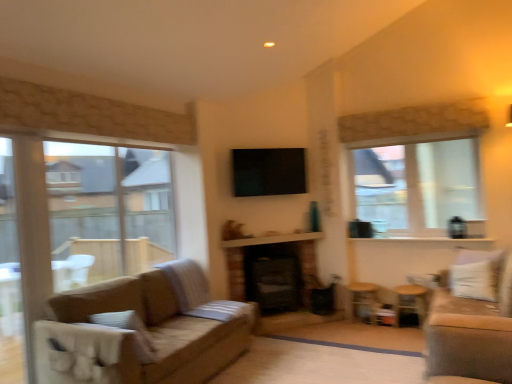
Question: Considering the relative sizes of white textured balcony at center and wooden side table at lower right, the 2th side table viewed from the left, in the image provided, is white textured balcony at center bigger than wooden side table at lower right, the 2th side table viewed from the left,?

Choices:
 (A) no
 (B) yes

Answer: (A)

Question: Is white textured balcony at center smaller than wooden side table at lower right, the 2th side table viewed from the left?

Choices:
 (A) yes
 (B) no

Answer: (A)

Question: Is white textured balcony at center with wooden side table at lower right, which appears as the first side table when viewed from the right?

Choices:
 (A) yes
 (B) no

Answer: (B)

Question: Considering the relative positions of white textured balcony at center and wooden side table at lower right, which appears as the first side table when viewed from the right, in the image provided, is white textured balcony at center to the left of wooden side table at lower right, which appears as the first side table when viewed from the right, from the viewer's perspective?

Choices:
 (A) no
 (B) yes

Answer: (B)

Question: Is the depth of white textured balcony at center greater than that of wooden side table at lower right, the 2th side table viewed from the left?

Choices:
 (A) no
 (B) yes

Answer: (B)

Question: Is white textured balcony at center taller than wooden side table at lower right, which appears as the first side table when viewed from the right?

Choices:
 (A) yes
 (B) no

Answer: (B)

Question: Considering the relative sizes of wooden side table at lower right, which is the second side table in right-to-left order, and black brick fireplace at center in the image provided, is wooden side table at lower right, which is the second side table in right-to-left order, thinner than black brick fireplace at center?

Choices:
 (A) yes
 (B) no

Answer: (A)

Question: Is black brick fireplace at center located within wooden side table at lower right, the 1th side table from the left?

Choices:
 (A) yes
 (B) no

Answer: (B)

Question: Considering the relative positions of wooden side table at lower right, which is the second side table in right-to-left order, and black brick fireplace at center in the image provided, is wooden side table at lower right, which is the second side table in right-to-left order, in front of black brick fireplace at center?

Choices:
 (A) no
 (B) yes

Answer: (B)

Question: From the image's perspective, is wooden side table at lower right, which is the second side table in right-to-left order, located beneath black brick fireplace at center?

Choices:
 (A) yes
 (B) no

Answer: (A)

Question: Are wooden side table at lower right, the 1th side table from the left, and black brick fireplace at center located far from each other?

Choices:
 (A) no
 (B) yes

Answer: (A)

Question: Is wooden side table at lower right, which is the second side table in right-to-left order, shorter than black brick fireplace at center?

Choices:
 (A) no
 (B) yes

Answer: (B)

Question: From the image's perspective, is clear glass window at left, the 1th window from the front, beneath black brick fireplace at center?

Choices:
 (A) yes
 (B) no

Answer: (B)